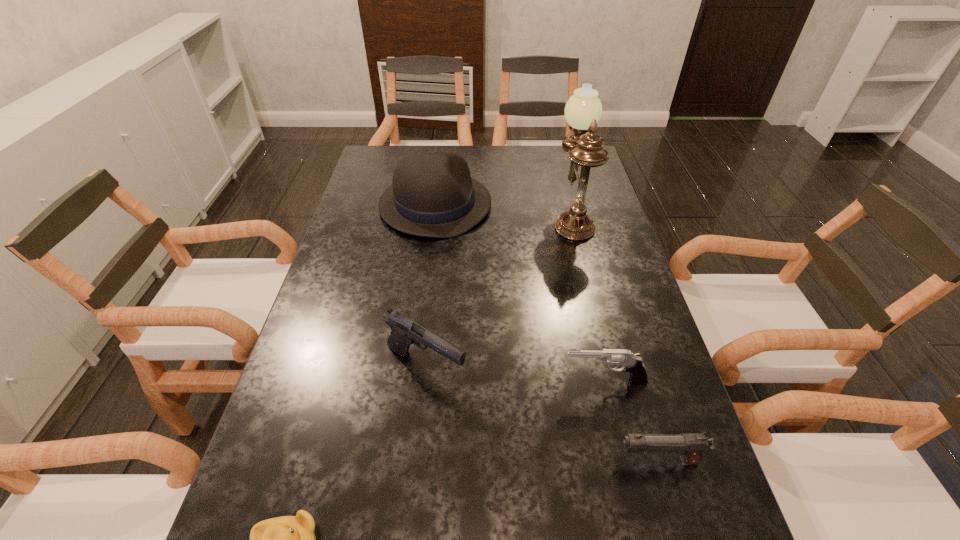
Where is `oil lamp`? This screenshot has width=960, height=540. oil lamp is located at coordinates (583, 110).

Image resolution: width=960 pixels, height=540 pixels. Identify the location of bowler hat. (432, 194).

The height and width of the screenshot is (540, 960). In order to click on the tallest gun in this screenshot , I will do `click(404, 331)`.

Locate an element on the screen. the leftmost gun is located at coordinates pos(404,331).

Locate an element on the screen. The image size is (960, 540). the nearest gun is located at coordinates tap(691, 445).

Find the location of a particular element. This screenshot has height=540, width=960. free space located 0.220m on the front of the oil lamp is located at coordinates (592, 296).

Find the location of a particular element. The height and width of the screenshot is (540, 960). vacant space situated on the front-facing side of the fifth shortest object is located at coordinates (554, 205).

At what (x,y) coordinates should I click in order to perform the action: click on vacant region located 0.210m at the muzzle of the leftmost gun. Please return your answer as a coordinate pair (x, y). Looking at the image, I should click on (564, 367).

I want to click on free space located 0.110m in the direction the second nearest object is aimed, so click(556, 461).

Where is `vacant space situated 0.380m in the direction the second nearest object is aimed`? Image resolution: width=960 pixels, height=540 pixels. vacant space situated 0.380m in the direction the second nearest object is aimed is located at coordinates (410, 461).